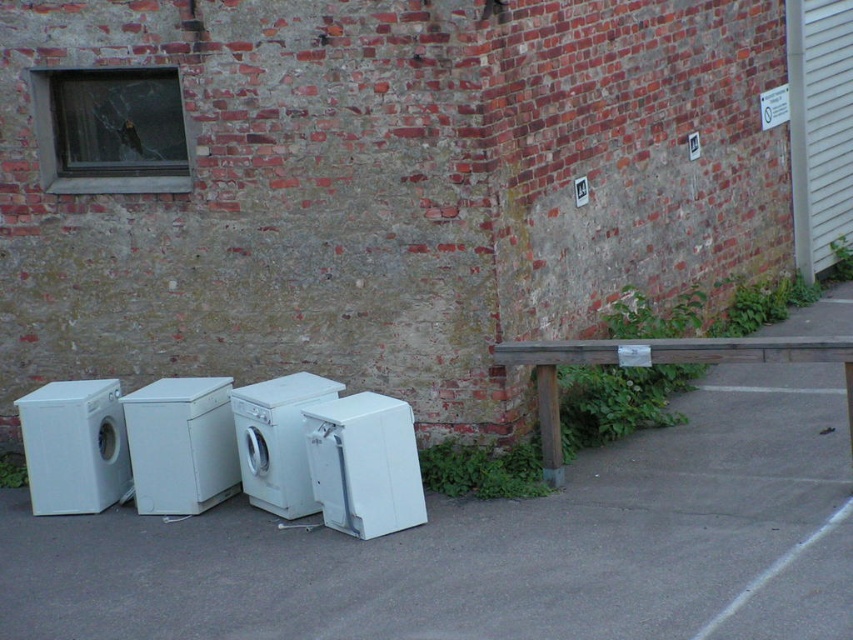
Can you confirm if white smooth pavement at lower center is bigger than wooden picnic table at right?

Indeed, white smooth pavement at lower center has a larger size compared to wooden picnic table at right.

Can you confirm if white smooth pavement at lower center is positioned to the right of wooden picnic table at right?

In fact, white smooth pavement at lower center is to the left of wooden picnic table at right.

At what (x,y) coordinates should I click in order to perform the action: click on white smooth pavement at lower center. Please return your answer as a coordinate pair (x, y). The width and height of the screenshot is (853, 640). Looking at the image, I should click on (497, 547).

Where is `white smooth pavement at lower center`? This screenshot has height=640, width=853. white smooth pavement at lower center is located at coordinates (497, 547).

In the scene shown: Is white smooth pavement at lower center smaller than white matte washing machine at left?

No, white smooth pavement at lower center is not smaller than white matte washing machine at left.

Is white smooth pavement at lower center closer to the viewer compared to white matte washing machine at left?

That is True.

The width and height of the screenshot is (853, 640). I want to click on white smooth pavement at lower center, so click(x=497, y=547).

Which is above, white glossy washing machine at center or white matte washing machine at center?

Positioned higher is white matte washing machine at center.

Does white glossy washing machine at center have a lesser height compared to white matte washing machine at center?

Correct, white glossy washing machine at center is not as tall as white matte washing machine at center.

Which is in front, point (223, 481) or point (248, 481)?

Point (248, 481)

Locate an element on the screen. Image resolution: width=853 pixels, height=640 pixels. white glossy washing machine at center is located at coordinates (181, 444).